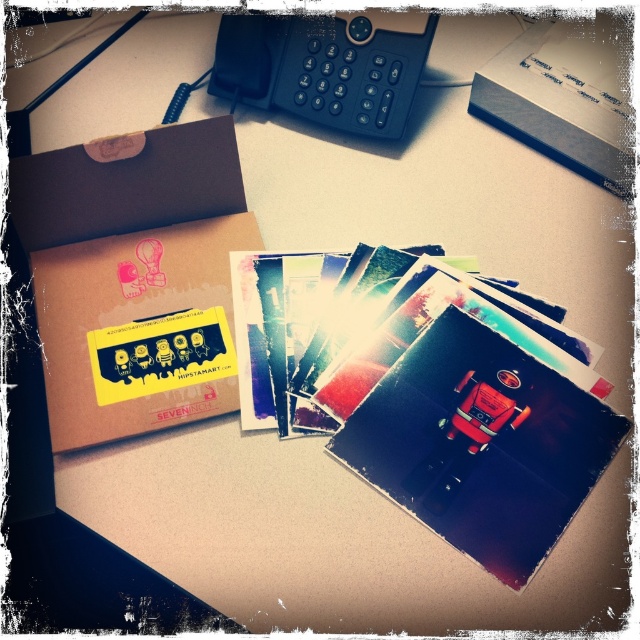
Question: Which object is closer to the camera taking this photo?

Choices:
 (A) brown cardboard box at upper left
 (B) black plastic phone at upper center
 (C) white cardboard box at upper center

Answer: (A)

Question: Which object is farther from the camera taking this photo?

Choices:
 (A) brown cardboard box at upper left
 (B) white cardboard box at upper center

Answer: (B)

Question: Is brown cardboard box at upper left to the right of black plastic phone at upper center from the viewer's perspective?

Choices:
 (A) yes
 (B) no

Answer: (B)

Question: Does brown cardboard box at upper left appear over black plastic phone at upper center?

Choices:
 (A) no
 (B) yes

Answer: (A)

Question: Which of the following is the farthest from the observer?

Choices:
 (A) (556, 109)
 (B) (410, 61)

Answer: (B)

Question: In this image, where is brown cardboard box at upper left located relative to white cardboard box at upper center?

Choices:
 (A) left
 (B) right

Answer: (A)